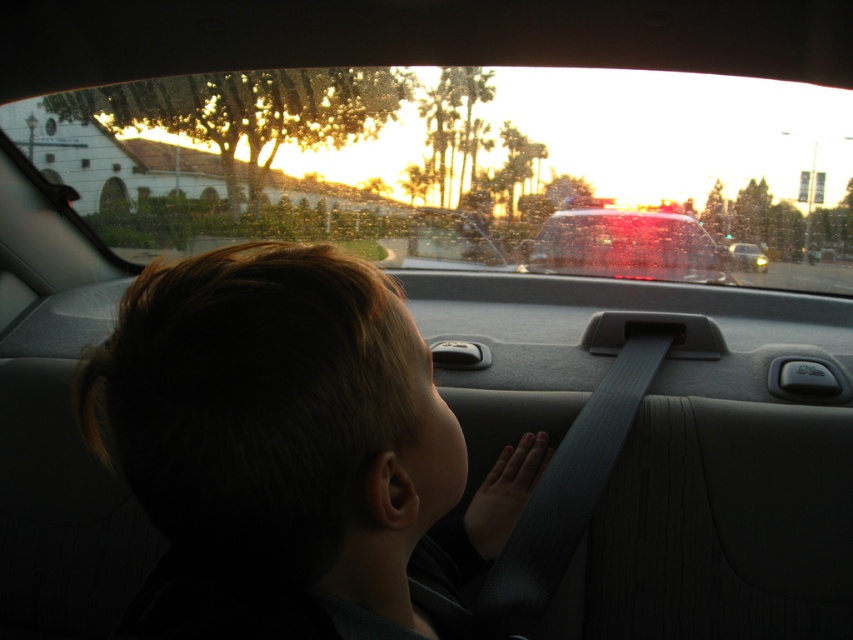
Looking at this image, does transparent glass car window at upper center have a greater width compared to dark hair at center?

Yes, transparent glass car window at upper center is wider than dark hair at center.

Is transparent glass car window at upper center to the right of dark hair at center from the viewer's perspective?

In fact, transparent glass car window at upper center is to the left of dark hair at center.

Identify the location of transparent glass car window at upper center. (465, 168).

Is shiny metallic car at center positioned before dark gray fabric hand at center?

No, shiny metallic car at center is behind dark gray fabric hand at center.

Does shiny metallic car at center have a greater width compared to dark gray fabric hand at center?

Yes, shiny metallic car at center is wider than dark gray fabric hand at center.

Is point (698, 230) in front of point (532, 480)?

No, (698, 230) is behind (532, 480).

The image size is (853, 640). In order to click on shiny metallic car at center in this screenshot , I will do point(627,244).

Based on the photo, can you confirm if transparent glass car window at upper center is positioned below matte black car at center?

Actually, transparent glass car window at upper center is above matte black car at center.

Does point (718, 280) come closer to viewer compared to point (749, 248)?

Yes, point (718, 280) is closer to viewer.

Identify the location of transparent glass car window at upper center. The height and width of the screenshot is (640, 853). (465, 168).